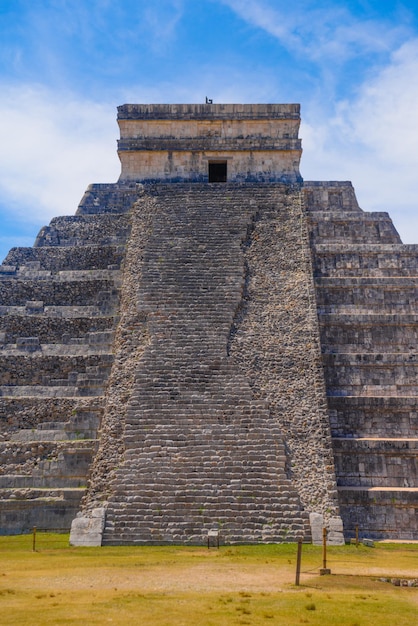
Locate an element on the screen. Image resolution: width=418 pixels, height=626 pixels. stone wall (left) is located at coordinates (39, 449).